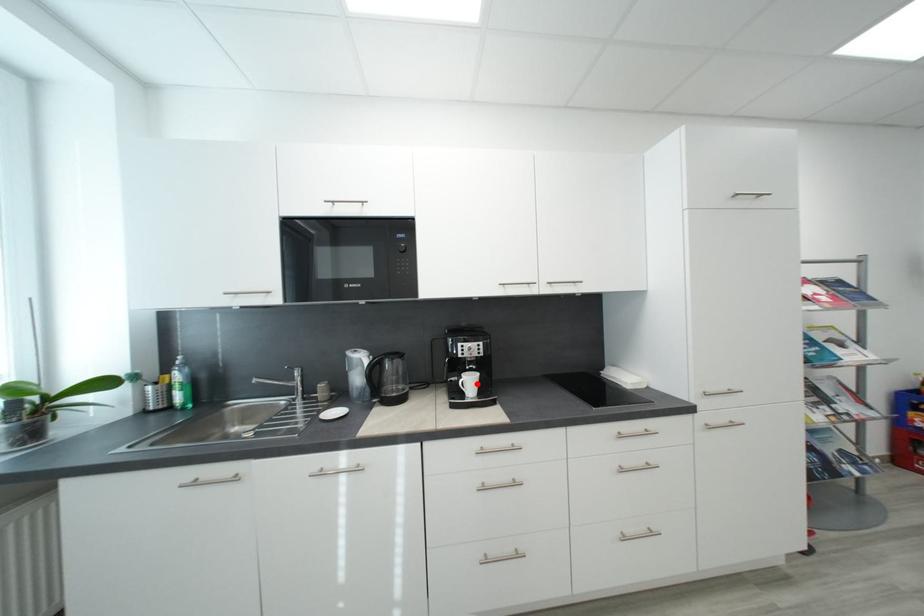
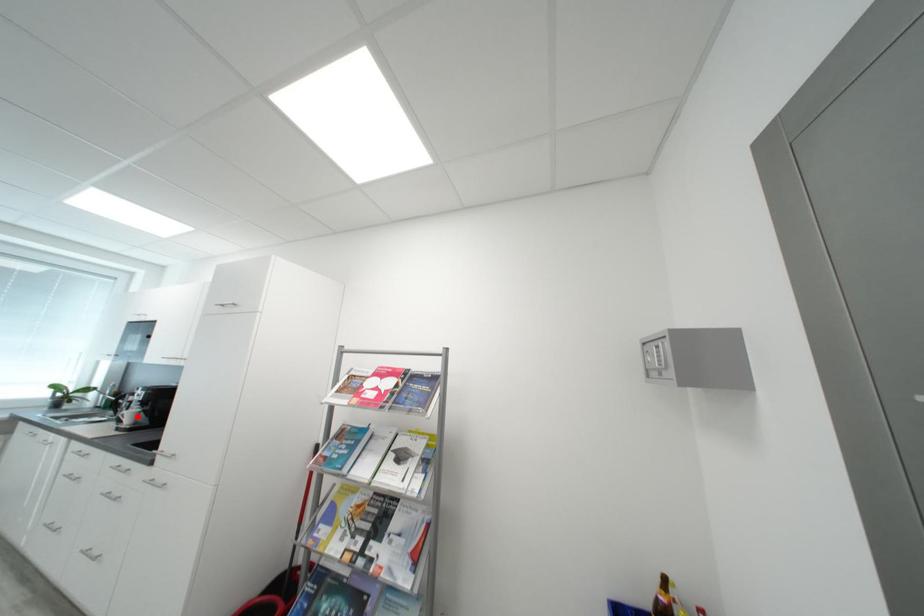
I am providing you with two images of the same scene from different viewpoints. A red point is marked on the first image and another point is marked on the second image. Is the red point in image1 aligned with the point shown in image2?

Yes